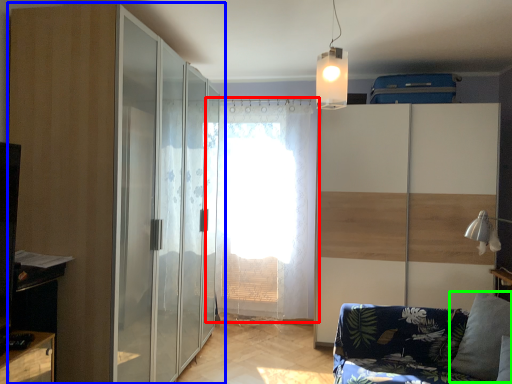
Question: Which object is positioned closest to curtain (highlighted by a red box)? Select from door (highlighted by a blue box) and pillow (highlighted by a green box).

Choices:
 (A) door
 (B) pillow

Answer: (A)